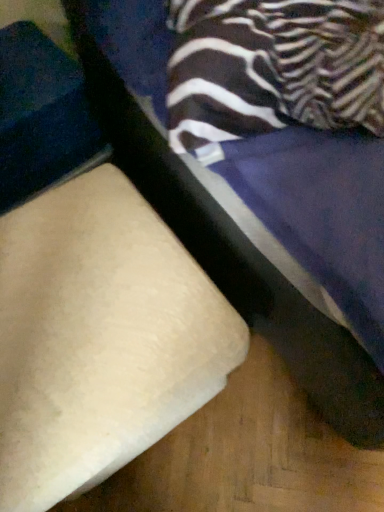
What do you see at coordinates (99, 338) in the screenshot? I see `beige fabric cushion at lower left, which ranks as the second furniture in right-to-left order` at bounding box center [99, 338].

Locate an element on the screen. This screenshot has height=512, width=384. beige fabric cushion at lower left, which is the 1th furniture in left-to-right order is located at coordinates (99, 338).

Consider the image. What is the approximate width of beige fabric ottoman at lower left, which appears as the 2th furniture when viewed from the left?

1.08 meters.

The image size is (384, 512). Find the location of `beige fabric ottoman at lower left, which appears as the 2th furniture when viewed from the left`. beige fabric ottoman at lower left, which appears as the 2th furniture when viewed from the left is located at coordinates [232, 251].

This screenshot has height=512, width=384. What do you see at coordinates (232, 251) in the screenshot? I see `beige fabric ottoman at lower left, the first furniture in the right-to-left sequence` at bounding box center [232, 251].

Where is `beige fabric cushion at lower left, which ranks as the second furniture in right-to-left order`? The image size is (384, 512). beige fabric cushion at lower left, which ranks as the second furniture in right-to-left order is located at coordinates (99, 338).

Based on their positions, is beige fabric cushion at lower left, which ranks as the second furniture in right-to-left order, located to the left or right of beige fabric ottoman at lower left, the first furniture in the right-to-left sequence?

Clearly, beige fabric cushion at lower left, which ranks as the second furniture in right-to-left order, is on the left of beige fabric ottoman at lower left, the first furniture in the right-to-left sequence, in the image.

Considering the positions of objects beige fabric cushion at lower left, which ranks as the second furniture in right-to-left order, and beige fabric ottoman at lower left, the first furniture in the right-to-left sequence, in the image provided, who is in front, beige fabric cushion at lower left, which ranks as the second furniture in right-to-left order, or beige fabric ottoman at lower left, the first furniture in the right-to-left sequence,?

beige fabric ottoman at lower left, the first furniture in the right-to-left sequence.

Does point (115, 255) appear closer or farther from the camera than point (191, 240)?

Clearly, point (115, 255) is closer to the camera than point (191, 240).

From the image's perspective, relative to beige fabric ottoman at lower left, which appears as the 2th furniture when viewed from the left, is beige fabric cushion at lower left, which is the 1th furniture in left-to-right order, above or below?

From the image's perspective, beige fabric cushion at lower left, which is the 1th furniture in left-to-right order, appears below beige fabric ottoman at lower left, which appears as the 2th furniture when viewed from the left.

From a real-world perspective, between beige fabric cushion at lower left, which is the 1th furniture in left-to-right order, and beige fabric ottoman at lower left, which appears as the 2th furniture when viewed from the left, who is vertically lower?

In real-world perspective, beige fabric cushion at lower left, which is the 1th furniture in left-to-right order, is lower.

Is beige fabric cushion at lower left, which ranks as the second furniture in right-to-left order, thinner than beige fabric ottoman at lower left, the first furniture in the right-to-left sequence?

Yes, beige fabric cushion at lower left, which ranks as the second furniture in right-to-left order, is thinner than beige fabric ottoman at lower left, the first furniture in the right-to-left sequence.

In the scene shown: Who is taller, beige fabric cushion at lower left, which ranks as the second furniture in right-to-left order, or beige fabric ottoman at lower left, which appears as the 2th furniture when viewed from the left?

Standing taller between the two is beige fabric ottoman at lower left, which appears as the 2th furniture when viewed from the left.

Is beige fabric cushion at lower left, which ranks as the second furniture in right-to-left order, bigger than beige fabric ottoman at lower left, which appears as the 2th furniture when viewed from the left?

Incorrect, beige fabric cushion at lower left, which ranks as the second furniture in right-to-left order, is not larger than beige fabric ottoman at lower left, which appears as the 2th furniture when viewed from the left.

Is beige fabric cushion at lower left, which is the 1th furniture in left-to-right order, completely or partially outside of beige fabric ottoman at lower left, the first furniture in the right-to-left sequence?

beige fabric cushion at lower left, which is the 1th furniture in left-to-right order, is positioned outside beige fabric ottoman at lower left, the first furniture in the right-to-left sequence.

Is beige fabric cushion at lower left, which is the 1th furniture in left-to-right order, directly adjacent to beige fabric ottoman at lower left, which appears as the 2th furniture when viewed from the left?

They are not placed beside each other.

Is beige fabric ottoman at lower left, the first furniture in the right-to-left sequence, at the back of beige fabric cushion at lower left, which ranks as the second furniture in right-to-left order?

No, beige fabric cushion at lower left, which ranks as the second furniture in right-to-left order, is not facing away from beige fabric ottoman at lower left, the first furniture in the right-to-left sequence.

What's the angular difference between beige fabric cushion at lower left, which ranks as the second furniture in right-to-left order, and beige fabric ottoman at lower left, the first furniture in the right-to-left sequence,'s facing directions?

The facing directions of beige fabric cushion at lower left, which ranks as the second furniture in right-to-left order, and beige fabric ottoman at lower left, the first furniture in the right-to-left sequence, are 1.84 degrees apart.

How distant is beige fabric cushion at lower left, which ranks as the second furniture in right-to-left order, from beige fabric ottoman at lower left, the first furniture in the right-to-left sequence?

A distance of 10.22 inches exists between beige fabric cushion at lower left, which ranks as the second furniture in right-to-left order, and beige fabric ottoman at lower left, the first furniture in the right-to-left sequence.

Where is `furniture located above the beige fabric cushion at lower left, which ranks as the second furniture in right-to-left order (from a real-world perspective)`? The image size is (384, 512). furniture located above the beige fabric cushion at lower left, which ranks as the second furniture in right-to-left order (from a real-world perspective) is located at coordinates (232, 251).

Visually, is beige fabric ottoman at lower left, the first furniture in the right-to-left sequence, positioned to the left or to the right of beige fabric cushion at lower left, which ranks as the second furniture in right-to-left order?

Based on their positions, beige fabric ottoman at lower left, the first furniture in the right-to-left sequence, is located to the right of beige fabric cushion at lower left, which ranks as the second furniture in right-to-left order.

Based on the photo, which object is more forward, beige fabric ottoman at lower left, the first furniture in the right-to-left sequence, or beige fabric cushion at lower left, which ranks as the second furniture in right-to-left order?

Positioned in front is beige fabric ottoman at lower left, the first furniture in the right-to-left sequence.

Considering the positions of point (366, 443) and point (22, 297), is point (366, 443) closer or farther from the camera than point (22, 297)?

Point (366, 443) appears to be farther away from the viewer than point (22, 297).

From the image's perspective, is beige fabric ottoman at lower left, which appears as the 2th furniture when viewed from the left, above or below beige fabric cushion at lower left, which is the 1th furniture in left-to-right order?

beige fabric ottoman at lower left, which appears as the 2th furniture when viewed from the left, is situated higher than beige fabric cushion at lower left, which is the 1th furniture in left-to-right order, in the image.

From a real-world perspective, which is physically above, beige fabric ottoman at lower left, which appears as the 2th furniture when viewed from the left, or beige fabric cushion at lower left, which ranks as the second furniture in right-to-left order?

In real-world perspective, beige fabric ottoman at lower left, which appears as the 2th furniture when viewed from the left, is above.

Is beige fabric ottoman at lower left, which appears as the 2th furniture when viewed from the left, wider than beige fabric cushion at lower left, which ranks as the second furniture in right-to-left order?

Indeed, beige fabric ottoman at lower left, which appears as the 2th furniture when viewed from the left, has a greater width compared to beige fabric cushion at lower left, which ranks as the second furniture in right-to-left order.

Is beige fabric ottoman at lower left, the first furniture in the right-to-left sequence, taller than beige fabric cushion at lower left, which is the 1th furniture in left-to-right order?

Yes, beige fabric ottoman at lower left, the first furniture in the right-to-left sequence, is taller than beige fabric cushion at lower left, which is the 1th furniture in left-to-right order.

Considering the relative sizes of beige fabric ottoman at lower left, which appears as the 2th furniture when viewed from the left, and beige fabric cushion at lower left, which ranks as the second furniture in right-to-left order, in the image provided, is beige fabric ottoman at lower left, which appears as the 2th furniture when viewed from the left, smaller than beige fabric cushion at lower left, which ranks as the second furniture in right-to-left order,?

No, beige fabric ottoman at lower left, which appears as the 2th furniture when viewed from the left, is not smaller than beige fabric cushion at lower left, which ranks as the second furniture in right-to-left order.

Do you think beige fabric ottoman at lower left, which appears as the 2th furniture when viewed from the left, is within beige fabric cushion at lower left, which ranks as the second furniture in right-to-left order, or outside of it?

beige fabric ottoman at lower left, which appears as the 2th furniture when viewed from the left, is not enclosed by beige fabric cushion at lower left, which ranks as the second furniture in right-to-left order.

Is the surface of beige fabric ottoman at lower left, which appears as the 2th furniture when viewed from the left, in direct contact with beige fabric cushion at lower left, which ranks as the second furniture in right-to-left order?

No, beige fabric ottoman at lower left, which appears as the 2th furniture when viewed from the left, is not making contact with beige fabric cushion at lower left, which ranks as the second furniture in right-to-left order.

Is beige fabric ottoman at lower left, the first furniture in the right-to-left sequence, looking in the opposite direction of beige fabric cushion at lower left, which ranks as the second furniture in right-to-left order?

No, beige fabric ottoman at lower left, the first furniture in the right-to-left sequence, is not facing the opposite direction of beige fabric cushion at lower left, which ranks as the second furniture in right-to-left order.

You are a GUI agent. You are given a task and a screenshot of the screen. Output one action in this format:
    pyautogui.click(x=<x>, y=<y>)
    Task: Click on the furniture on the right of the beige fabric cushion at lower left, which ranks as the second furniture in right-to-left order
    The image size is (384, 512).
    Given the screenshot: What is the action you would take?
    pyautogui.click(x=232, y=251)

You are a GUI agent. You are given a task and a screenshot of the screen. Output one action in this format:
    pyautogui.click(x=<x>, y=<y>)
    Task: Click on the furniture behind the beige fabric ottoman at lower left, which appears as the 2th furniture when viewed from the left
    This screenshot has width=384, height=512.
    Given the screenshot: What is the action you would take?
    pyautogui.click(x=99, y=338)

Locate an element on the screen. furniture on the right of beige fabric cushion at lower left, which ranks as the second furniture in right-to-left order is located at coordinates (232, 251).